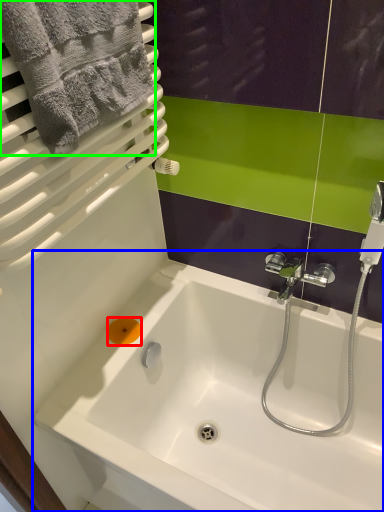
Question: Which object is the closest to the soap (highlighted by a red box)? Choose among these: bathtub (highlighted by a blue box) or towel (highlighted by a green box).

Choices:
 (A) bathtub
 (B) towel

Answer: (A)